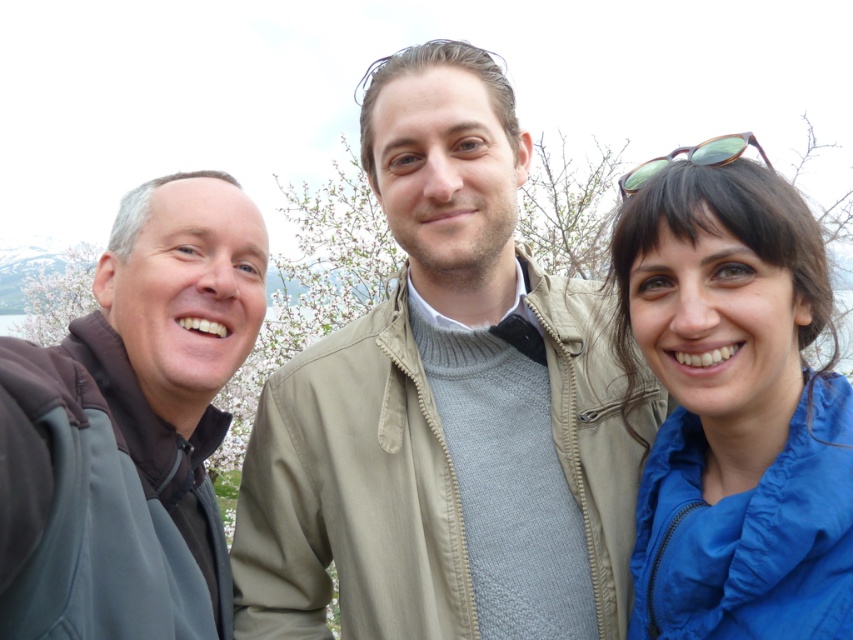
Question: Which point appears closest to the camera in this image?

Choices:
 (A) click(647, 244)
 (B) click(712, 161)
 (C) click(65, 461)

Answer: (C)

Question: Does light beige jacket at center have a lesser width compared to white blossoms at left?

Choices:
 (A) yes
 (B) no

Answer: (A)

Question: Can you confirm if blue nylon jacket at right is positioned below dark gray fleece jacket at left?

Choices:
 (A) no
 (B) yes

Answer: (A)

Question: Where is light beige jacket at center located in relation to green acetate sunglasses at upper right in the image?

Choices:
 (A) right
 (B) left

Answer: (B)

Question: Which object appears closest to the camera in this image?

Choices:
 (A) blue nylon jacket at right
 (B) white blossoms at left

Answer: (A)

Question: Among these objects, which one is farthest from the camera?

Choices:
 (A) green acetate sunglasses at upper right
 (B) light beige jacket at center
 (C) white blossoms at left
 (D) dark gray fleece jacket at left

Answer: (C)